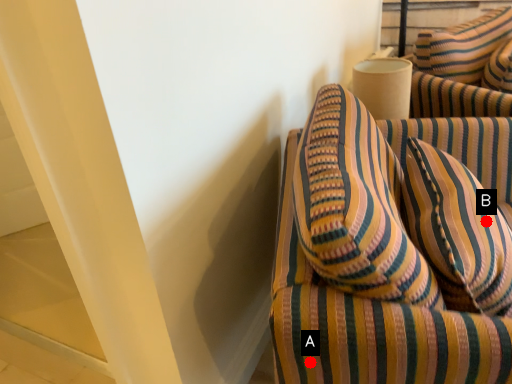
Question: Two points are circled on the image, labeled by A and B beside each circle. Among these points, which one is nearest to the camera?

Choices:
 (A) A is closer
 (B) B is closer

Answer: (A)